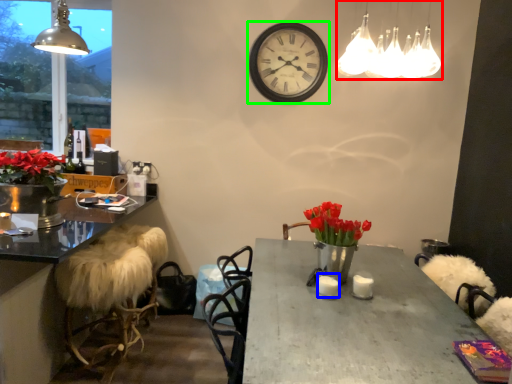
Question: Which object is positioned closest to lamp (highlighted by a red box)? Select from candle (highlighted by a blue box) and wall clock (highlighted by a green box).

Choices:
 (A) candle
 (B) wall clock

Answer: (A)